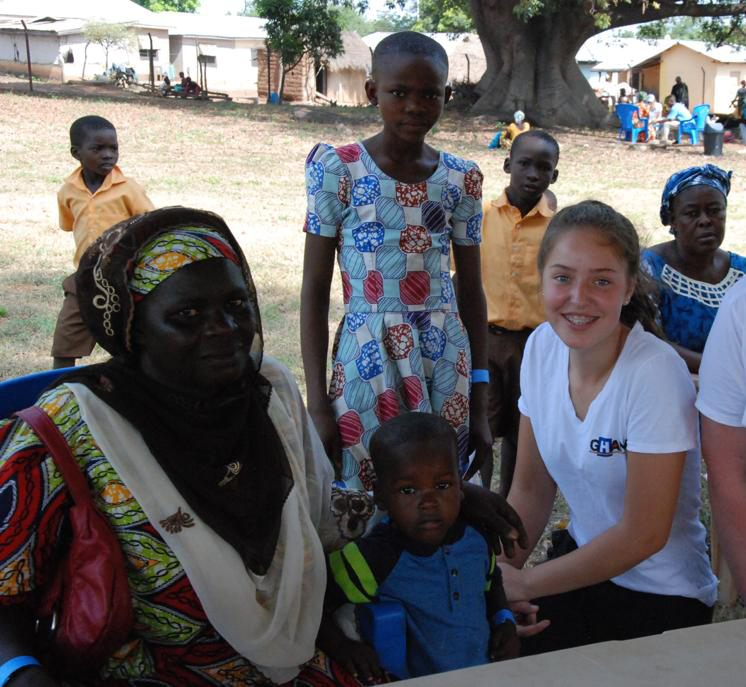
I want to click on blue chair, so click(691, 130).